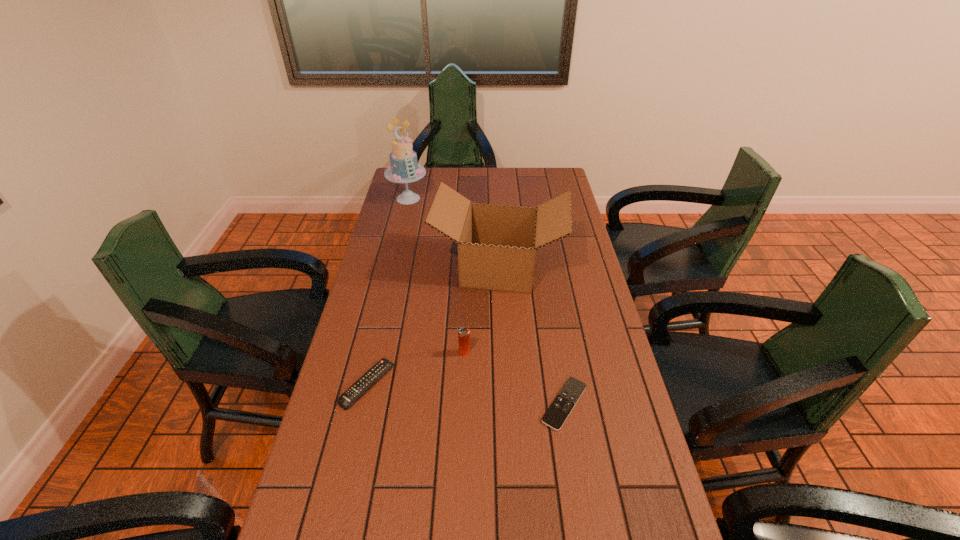
Where is `free space located 0.250m with a ladder on the side of the tallest object`? The width and height of the screenshot is (960, 540). free space located 0.250m with a ladder on the side of the tallest object is located at coordinates (397, 245).

The width and height of the screenshot is (960, 540). Find the location of `vacant space located 0.190m on the front of the box`. vacant space located 0.190m on the front of the box is located at coordinates (502, 341).

I want to click on free spot located on the back of the third nearest object, so click(466, 315).

Identify the location of vacant space located on the front of the left remote control. The image size is (960, 540). (336, 524).

This screenshot has width=960, height=540. I want to click on vacant space situated on the front of the shortest object, so click(573, 454).

The width and height of the screenshot is (960, 540). What are the coordinates of `object that is at the far edge` in the screenshot? It's located at (403, 168).

The height and width of the screenshot is (540, 960). What are the coordinates of `cake located at the left edge` in the screenshot? It's located at (x=403, y=168).

Locate an element on the screen. Image resolution: width=960 pixels, height=540 pixels. remote control positioned at the left edge is located at coordinates (353, 393).

Image resolution: width=960 pixels, height=540 pixels. Find the location of `box at the right edge`. box at the right edge is located at coordinates (497, 244).

The height and width of the screenshot is (540, 960). Find the location of `remote control present at the right edge`. remote control present at the right edge is located at coordinates (561, 407).